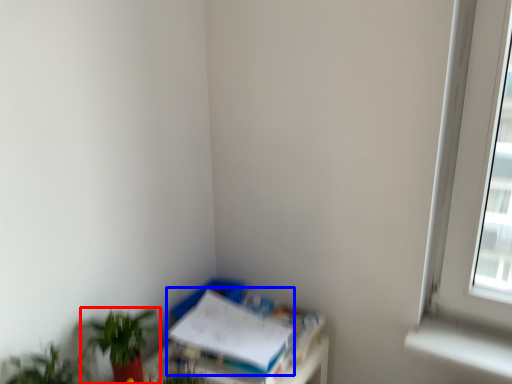
Question: Which point is further to the camera, houseplant (highlighted by a red box) or paperback book (highlighted by a blue box)?

Choices:
 (A) houseplant
 (B) paperback book

Answer: (B)